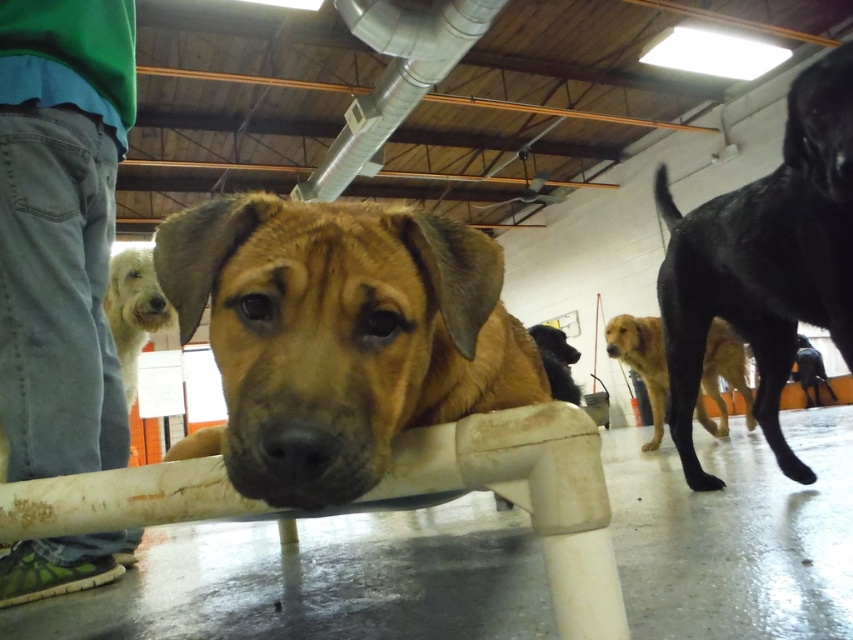
Question: Which of these objects is positioned farthest from the fuzzy white dog at upper left?

Choices:
 (A) brown furry dog at center
 (B) green denim pants at left

Answer: (A)

Question: Which object is the farthest from the brown matte dog at center?

Choices:
 (A) fuzzy white dog at upper left
 (B) green denim pants at left
 (C) brown furry dog at center
 (D) golden brown fur at center

Answer: (C)

Question: Which point is closer to the camera?

Choices:
 (A) brown matte dog at center
 (B) brown furry dog at center
 (C) green denim pants at left
 (D) black glossy dog at upper right

Answer: (B)

Question: Is green denim pants at left bigger than golden brown fur at center?

Choices:
 (A) yes
 (B) no

Answer: (B)

Question: Can you confirm if green denim pants at left is positioned above golden brown fur at center?

Choices:
 (A) no
 (B) yes

Answer: (B)

Question: Does black glossy dog at upper right come behind brown matte dog at center?

Choices:
 (A) no
 (B) yes

Answer: (A)